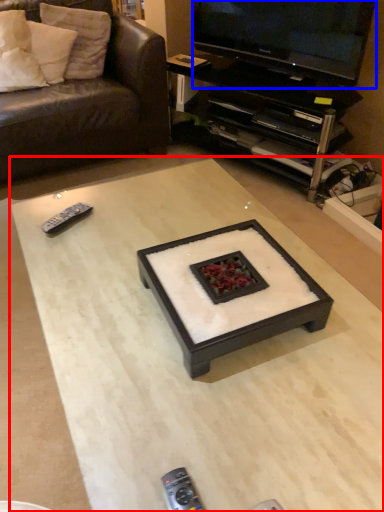
Question: Which of the following is the farthest to the observer, coffee table (highlighted by a red box) or television (highlighted by a blue box)?

Choices:
 (A) coffee table
 (B) television

Answer: (B)